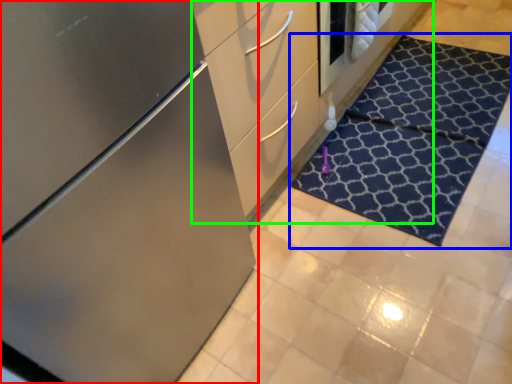
Question: Which object is positioned closest to cabinetry (highlighted by a red box)? Select from doormat (highlighted by a blue box) and dresser (highlighted by a green box).

Choices:
 (A) doormat
 (B) dresser

Answer: (B)